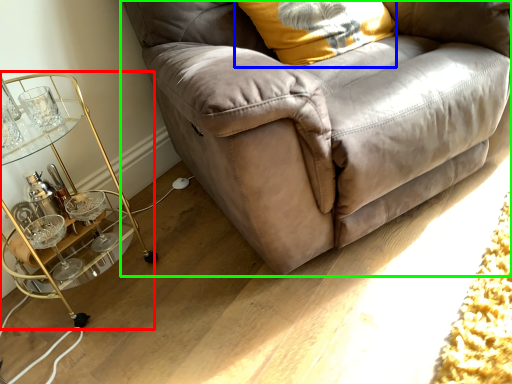
Question: Based on their relative distances, which object is nearer to table (highlighted by a red box)? Choose from pillow (highlighted by a blue box) and studio couch (highlighted by a green box).

Choices:
 (A) pillow
 (B) studio couch

Answer: (B)